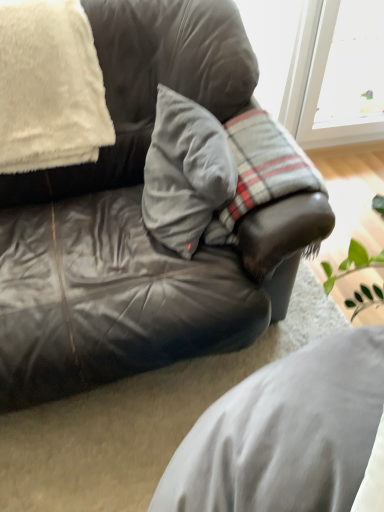
Question: Is white fluffy blanket at upper left, which ranks as the first pillow in left-to-right order, located outside leather cushion at center?

Choices:
 (A) no
 (B) yes

Answer: (B)

Question: Is white fluffy blanket at upper left, positioned as the 2th pillow in right-to-left order, not close to leather cushion at center?

Choices:
 (A) yes
 (B) no

Answer: (B)

Question: Does white fluffy blanket at upper left, which ranks as the first pillow in left-to-right order, have a lesser width compared to leather cushion at center?

Choices:
 (A) yes
 (B) no

Answer: (A)

Question: Is white fluffy blanket at upper left, positioned as the 2th pillow in right-to-left order, at the left side of leather cushion at center?

Choices:
 (A) no
 (B) yes

Answer: (B)

Question: From the image's perspective, is white fluffy blanket at upper left, positioned as the 2th pillow in right-to-left order, beneath leather cushion at center?

Choices:
 (A) yes
 (B) no

Answer: (B)

Question: From the image's perspective, does white fluffy blanket at upper left, which ranks as the first pillow in left-to-right order, appear higher than leather cushion at center?

Choices:
 (A) yes
 (B) no

Answer: (A)

Question: Does gray cotton pillow at center, positioned as the 1th pillow in right-to-left order, come in front of white fluffy blanket at upper left, positioned as the 2th pillow in right-to-left order?

Choices:
 (A) no
 (B) yes

Answer: (B)

Question: From a real-world perspective, is gray cotton pillow at center, positioned as the 1th pillow in right-to-left order, located higher than white fluffy blanket at upper left, which ranks as the first pillow in left-to-right order?

Choices:
 (A) yes
 (B) no

Answer: (B)

Question: Is gray cotton pillow at center, the 2th pillow when ordered from left to right, to the left of white fluffy blanket at upper left, positioned as the 2th pillow in right-to-left order, from the viewer's perspective?

Choices:
 (A) no
 (B) yes

Answer: (A)

Question: Can you confirm if gray cotton pillow at center, the 2th pillow when ordered from left to right, is shorter than white fluffy blanket at upper left, which ranks as the first pillow in left-to-right order?

Choices:
 (A) yes
 (B) no

Answer: (A)

Question: Can you confirm if gray cotton pillow at center, positioned as the 1th pillow in right-to-left order, is positioned to the right of white fluffy blanket at upper left, which ranks as the first pillow in left-to-right order?

Choices:
 (A) yes
 (B) no

Answer: (A)

Question: Is gray cotton pillow at center, the 2th pillow when ordered from left to right, behind white fluffy blanket at upper left, positioned as the 2th pillow in right-to-left order?

Choices:
 (A) yes
 (B) no

Answer: (B)

Question: From the image's perspective, is gray cotton pillow at center, positioned as the 1th pillow in right-to-left order, beneath matte gray leather couch at center?

Choices:
 (A) yes
 (B) no

Answer: (B)